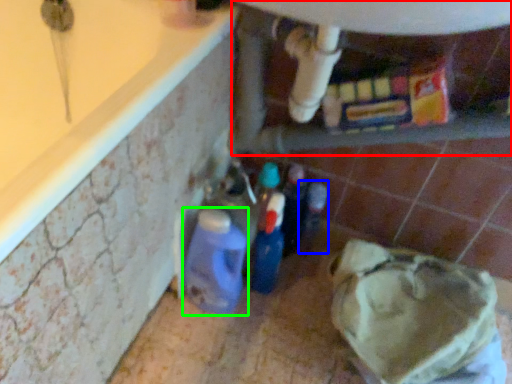
Question: Which object is the farthest from water heater (highlighted by a red box)? Choose among these: bottle (highlighted by a blue box) or bottle (highlighted by a green box).

Choices:
 (A) bottle
 (B) bottle

Answer: (B)